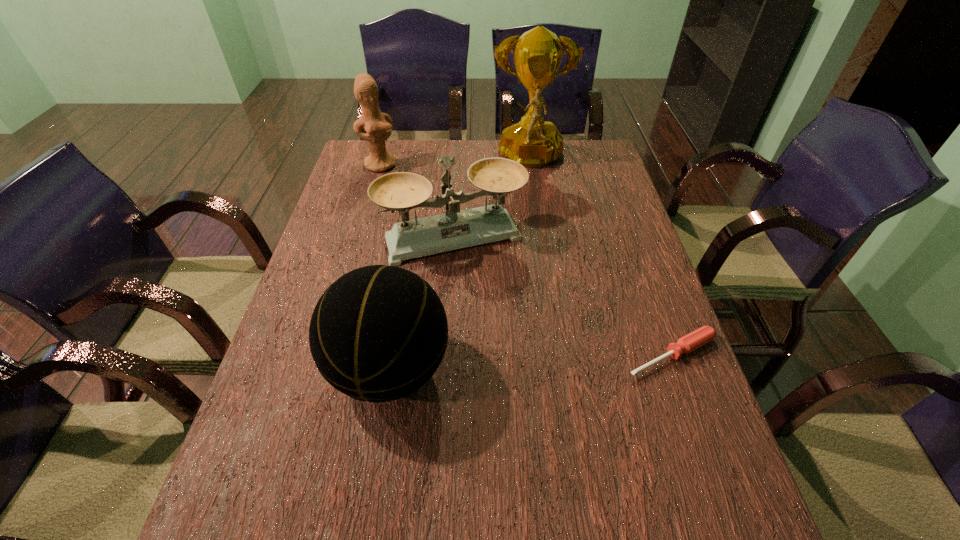
This screenshot has width=960, height=540. I want to click on vacant space on the desktop that is between the basketball and the rightmost object and is positioned on the front side of the tallest object, so click(x=540, y=361).

Locate an element on the screen. The image size is (960, 540). vacant space on the desktop that is between the basketball and the screwdriver and is positioned on the front-facing side of the third nearest object is located at coordinates (505, 363).

Image resolution: width=960 pixels, height=540 pixels. I want to click on vacant space on the desktop that is between the basketball and the screwdriver and is positioned on the front-facing side of the figurine, so (552, 361).